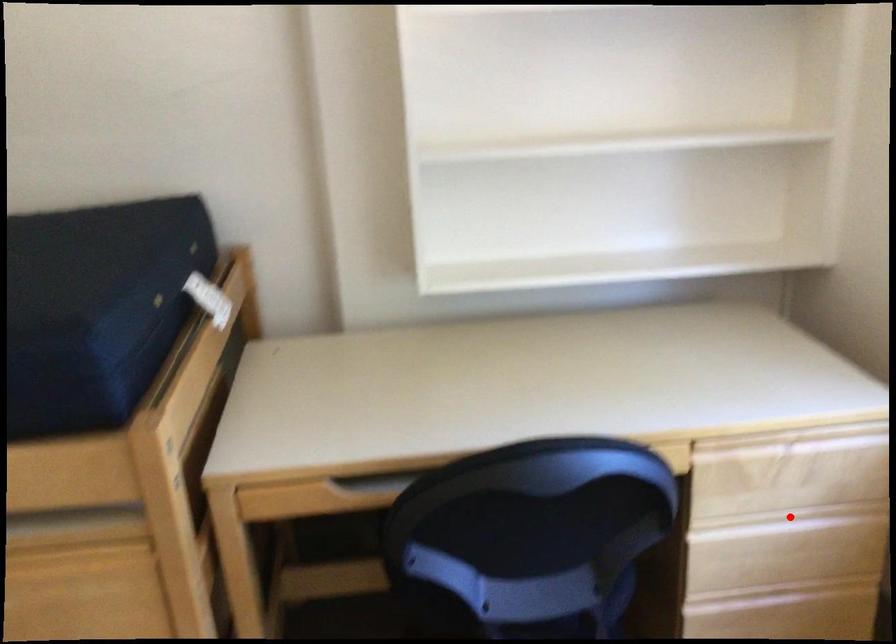
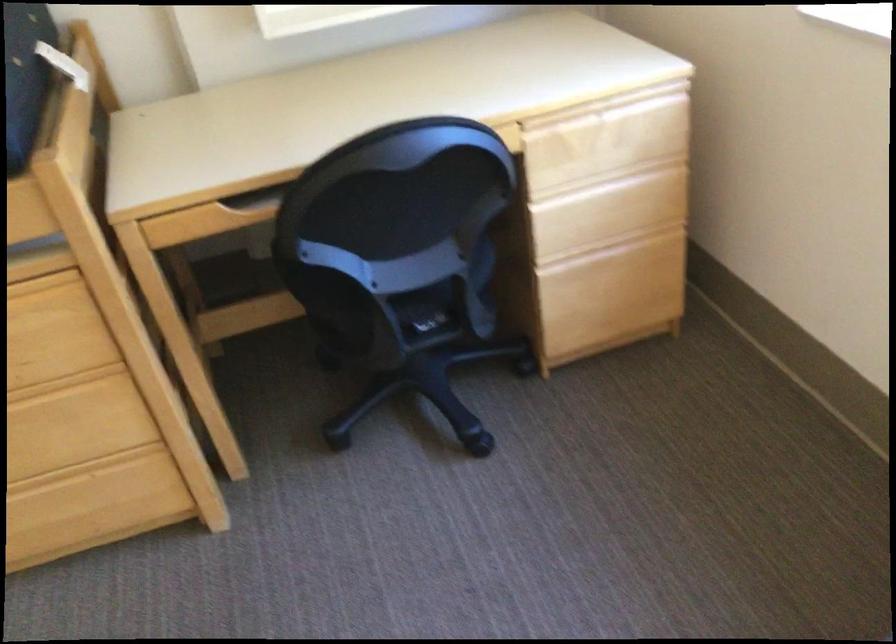
Question: I am providing you with two images of the same scene from different viewpoints. Image1 has a red point marked. In image2, the corresponding 3D location appears at what relative position? Reply with the corresponding letter.

Choices:
 (A) Closer
 (B) Farther

Answer: (B)